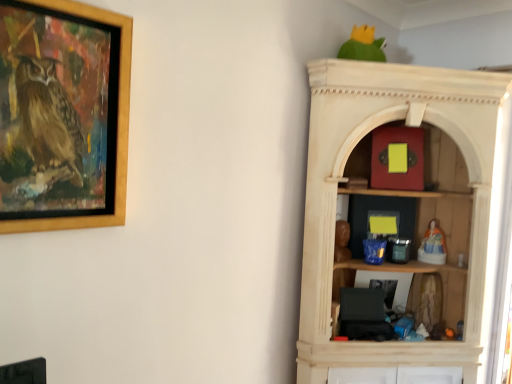
Find the location of a particular element. empty space that is ontop of wooden picture frame at upper left (from a real-world perspective) is located at coordinates (92, 7).